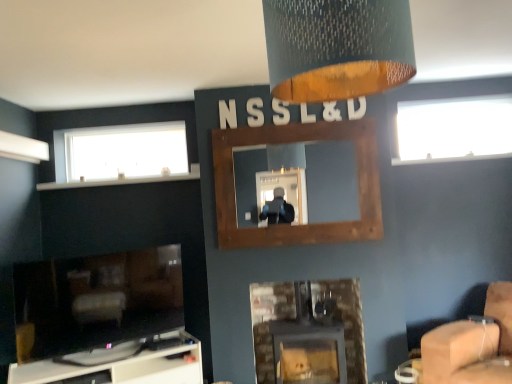
Question: Can you confirm if transparent glass window at upper right, the first window from the right, is positioned to the right of textured fabric lampshade at upper center?

Choices:
 (A) yes
 (B) no

Answer: (A)

Question: Can you confirm if transparent glass window at upper right, the first window from the right, is taller than textured fabric lampshade at upper center?

Choices:
 (A) no
 (B) yes

Answer: (B)

Question: Can you confirm if transparent glass window at upper right, the 2th window viewed from the left, is positioned to the left of textured fabric lampshade at upper center?

Choices:
 (A) yes
 (B) no

Answer: (B)

Question: Is transparent glass window at upper right, the 2th window viewed from the left, positioned beyond the bounds of textured fabric lampshade at upper center?

Choices:
 (A) yes
 (B) no

Answer: (A)

Question: From a real-world perspective, is transparent glass window at upper right, the first window from the right, positioned under textured fabric lampshade at upper center based on gravity?

Choices:
 (A) no
 (B) yes

Answer: (B)

Question: Is brick fireplace at center, acting as the 1th fireplace starting from the right, taller or shorter than white frosted glass window at upper left, which is counted as the second window, starting from the right?

Choices:
 (A) tall
 (B) short

Answer: (A)

Question: Considering the positions of brick fireplace at center, acting as the 1th fireplace starting from the right, and white frosted glass window at upper left, the first window positioned from the left, in the image, is brick fireplace at center, acting as the 1th fireplace starting from the right, wider or thinner than white frosted glass window at upper left, the first window positioned from the left,?

Choices:
 (A) wide
 (B) thin

Answer: (A)

Question: Which is correct: brick fireplace at center, acting as the 1th fireplace starting from the right, is inside white frosted glass window at upper left, which is counted as the second window, starting from the right, or outside of it?

Choices:
 (A) inside
 (B) outside

Answer: (B)

Question: Visually, is brick fireplace at center, the 3th fireplace positioned from the left, positioned to the left or to the right of white frosted glass window at upper left, which is counted as the second window, starting from the right?

Choices:
 (A) right
 (B) left

Answer: (A)

Question: Looking at the image, does white frosted glass window at upper left, the first window positioned from the left, seem bigger or smaller compared to matte black fireplace at lower left, marked as the third fireplace in a right-to-left arrangement?

Choices:
 (A) small
 (B) big

Answer: (A)

Question: Is point (100, 135) closer or farther from the camera than point (155, 314)?

Choices:
 (A) closer
 (B) farther

Answer: (B)

Question: In terms of width, does white frosted glass window at upper left, which is counted as the second window, starting from the right, look wider or thinner when compared to matte black fireplace at lower left, marked as the third fireplace in a right-to-left arrangement?

Choices:
 (A) thin
 (B) wide

Answer: (A)

Question: Considering the positions of white frosted glass window at upper left, the first window positioned from the left, and matte black fireplace at lower left, marked as the third fireplace in a right-to-left arrangement, in the image, is white frosted glass window at upper left, the first window positioned from the left, taller or shorter than matte black fireplace at lower left, marked as the third fireplace in a right-to-left arrangement,?

Choices:
 (A) short
 (B) tall

Answer: (A)

Question: From the image's perspective, is matte black fireplace at lower left, marked as the third fireplace in a right-to-left arrangement, positioned above or below transparent glass window at upper right, the 2th window viewed from the left?

Choices:
 (A) below
 (B) above

Answer: (A)

Question: Is matte black fireplace at lower left, marked as the third fireplace in a right-to-left arrangement, situated inside transparent glass window at upper right, the first window from the right, or outside?

Choices:
 (A) inside
 (B) outside

Answer: (B)